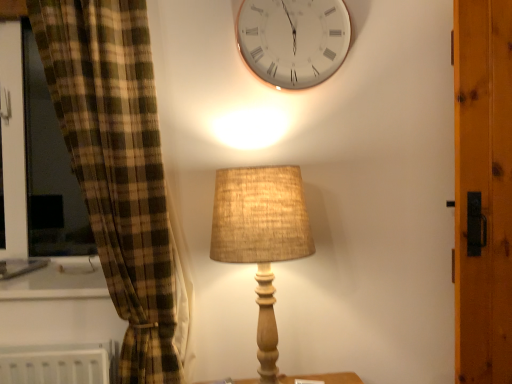
The width and height of the screenshot is (512, 384). Describe the element at coordinates (293, 40) in the screenshot. I see `white glossy clock at upper center` at that location.

The width and height of the screenshot is (512, 384). What are the coordinates of `white glossy clock at upper center` in the screenshot? It's located at (293, 40).

The image size is (512, 384). What do you see at coordinates (261, 237) in the screenshot?
I see `burlap lampshade at center` at bounding box center [261, 237].

Measure the distance between point (x=270, y=219) and camera.

Point (x=270, y=219) and camera are 1.13 meters apart.

Identify the location of burlap lampshade at center. The height and width of the screenshot is (384, 512). (261, 237).

Identify the location of white glossy clock at upper center. The width and height of the screenshot is (512, 384). (293, 40).

Which object is positioned more to the right, white glossy clock at upper center or burlap lampshade at center?

From the viewer's perspective, white glossy clock at upper center appears more on the right side.

In the scene shown: Is white glossy clock at upper center further to the viewer compared to burlap lampshade at center?

That is True.

Which point is more distant from viewer, (336, 69) or (280, 189)?

Positioned behind is point (336, 69).

From the image's perspective, which one is positioned lower, white glossy clock at upper center or burlap lampshade at center?

burlap lampshade at center.

From a real-world perspective, is white glossy clock at upper center physically located above or below burlap lampshade at center?

Clearly, from a real-world perspective, white glossy clock at upper center is above burlap lampshade at center.

Is white glossy clock at upper center thinner than burlap lampshade at center?

Indeed, white glossy clock at upper center has a lesser width compared to burlap lampshade at center.

Between white glossy clock at upper center and burlap lampshade at center, which one has more height?

Standing taller between the two is burlap lampshade at center.

Considering the sizes of white glossy clock at upper center and burlap lampshade at center in the image, is white glossy clock at upper center bigger or smaller than burlap lampshade at center?

Considering their sizes, white glossy clock at upper center takes up less space than burlap lampshade at center.

Is burlap lampshade at center surrounded by white glossy clock at upper center?

Definitely not — burlap lampshade at center is not inside white glossy clock at upper center.

Are white glossy clock at upper center and burlap lampshade at center far apart?

No, white glossy clock at upper center is not far away from burlap lampshade at center.

Is white glossy clock at upper center positioned with its back to burlap lampshade at center?

No.

What's the angular difference between white glossy clock at upper center and burlap lampshade at center's facing directions?

They differ by 0.89 degrees in their facing directions.

Find the location of a particular element. This screenshot has height=384, width=512. wall clock behind the burlap lampshade at center is located at coordinates (293, 40).

Considering the relative positions of burlap lampshade at center and white glossy clock at upper center in the image provided, is burlap lampshade at center to the left or to the right of white glossy clock at upper center?

Clearly, burlap lampshade at center is on the left of white glossy clock at upper center in the image.

Considering the relative positions of burlap lampshade at center and white glossy clock at upper center in the image provided, is burlap lampshade at center behind white glossy clock at upper center?

No, it is in front of white glossy clock at upper center.

Considering the points (275, 364) and (242, 53), which point is in front, point (275, 364) or point (242, 53)?

The point (275, 364) is closer.

From the image's perspective, between burlap lampshade at center and white glossy clock at upper center, which one is located above?

white glossy clock at upper center, from the image's perspective.

From a real-world perspective, is burlap lampshade at center over white glossy clock at upper center?

No, from a real-world perspective, burlap lampshade at center is not above white glossy clock at upper center.

Is burlap lampshade at center wider or thinner than white glossy clock at upper center?

In the image, burlap lampshade at center appears to be wider than white glossy clock at upper center.

From their relative heights in the image, would you say burlap lampshade at center is taller or shorter than white glossy clock at upper center?

Clearly, burlap lampshade at center is taller compared to white glossy clock at upper center.

In the scene shown: Does burlap lampshade at center have a larger size compared to white glossy clock at upper center?

Yes, burlap lampshade at center is bigger than white glossy clock at upper center.

Is burlap lampshade at center not inside white glossy clock at upper center?

Yes, burlap lampshade at center is outside of white glossy clock at upper center.

Is burlap lampshade at center next to white glossy clock at upper center?

There is a gap between burlap lampshade at center and white glossy clock at upper center.

Looking at this image, is burlap lampshade at center facing away from white glossy clock at upper center?

No, burlap lampshade at center's orientation is not away from white glossy clock at upper center.

At what (x,y) coordinates should I click in order to perform the action: click on wall clock above the burlap lampshade at center (from the image's perspective). Please return your answer as a coordinate pair (x, y). Looking at the image, I should click on (293, 40).

I want to click on wall clock behind the burlap lampshade at center, so click(x=293, y=40).

This screenshot has width=512, height=384. In order to click on lamp below the white glossy clock at upper center (from the image's perspective) in this screenshot , I will do `click(261, 237)`.